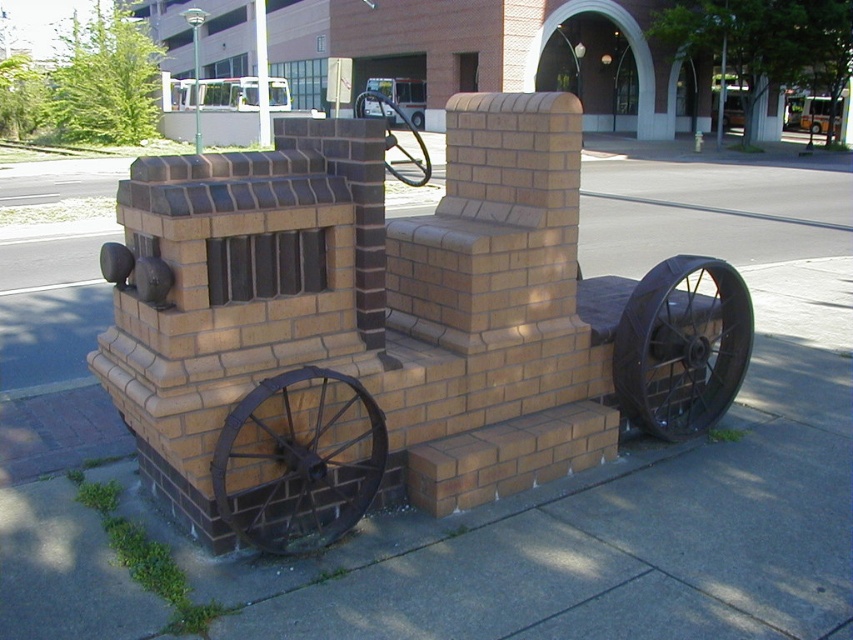
You are standing 10 feet away from the brick sculpture of a fire truck. There is a point at coordinates point (698, 260). Can you reach that point with your hand?

The distance of point (698, 260) from camera is 13.07 feet, so you are 10 feet away from the sculpture, which means the point is 3.07 feet away from you. Since the average human arm length is about 2.5 feet, you cannot reach the point with your hand.